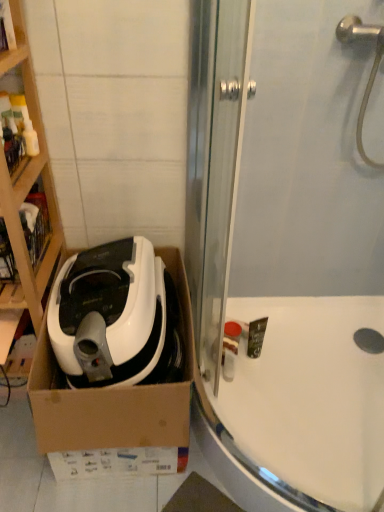
The width and height of the screenshot is (384, 512). What are the coordinates of `free space underneath transparent glass shower door at upper center (from a real-world perspective)` in the screenshot? It's located at (263, 468).